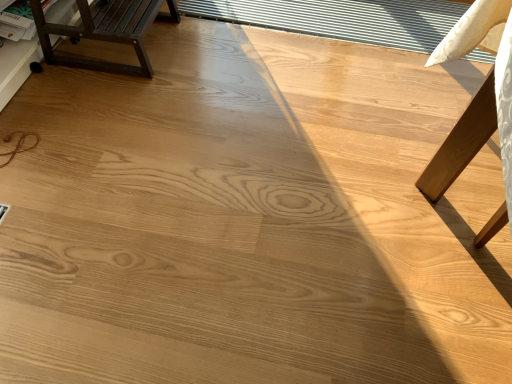
Question: Does transparent plastic window at upper center turn towards matte dark brown wooden bench at upper left?

Choices:
 (A) yes
 (B) no

Answer: (B)

Question: Is transparent plastic window at upper center bigger than matte dark brown wooden bench at upper left?

Choices:
 (A) no
 (B) yes

Answer: (A)

Question: Can you confirm if transparent plastic window at upper center is smaller than matte dark brown wooden bench at upper left?

Choices:
 (A) no
 (B) yes

Answer: (B)

Question: Is transparent plastic window at upper center thinner than matte dark brown wooden bench at upper left?

Choices:
 (A) yes
 (B) no

Answer: (B)

Question: Can you confirm if transparent plastic window at upper center is taller than matte dark brown wooden bench at upper left?

Choices:
 (A) no
 (B) yes

Answer: (A)

Question: Can you confirm if transparent plastic window at upper center is positioned to the left of matte dark brown wooden bench at upper left?

Choices:
 (A) yes
 (B) no

Answer: (B)

Question: From the image's perspective, would you say matte dark brown wooden bench at upper left is positioned over transparent plastic window at upper center?

Choices:
 (A) no
 (B) yes

Answer: (A)

Question: Is matte dark brown wooden bench at upper left positioned before transparent plastic window at upper center?

Choices:
 (A) no
 (B) yes

Answer: (B)

Question: From the image's perspective, is matte dark brown wooden bench at upper left beneath transparent plastic window at upper center?

Choices:
 (A) no
 (B) yes

Answer: (B)

Question: Is matte dark brown wooden bench at upper left oriented away from transparent plastic window at upper center?

Choices:
 (A) yes
 (B) no

Answer: (B)

Question: Is matte dark brown wooden bench at upper left located outside transparent plastic window at upper center?

Choices:
 (A) no
 (B) yes

Answer: (B)

Question: Is matte dark brown wooden bench at upper left behind transparent plastic window at upper center?

Choices:
 (A) no
 (B) yes

Answer: (A)

Question: Is matte dark brown wooden bench at upper left inside or outside of transparent plastic window at upper center?

Choices:
 (A) inside
 (B) outside

Answer: (B)